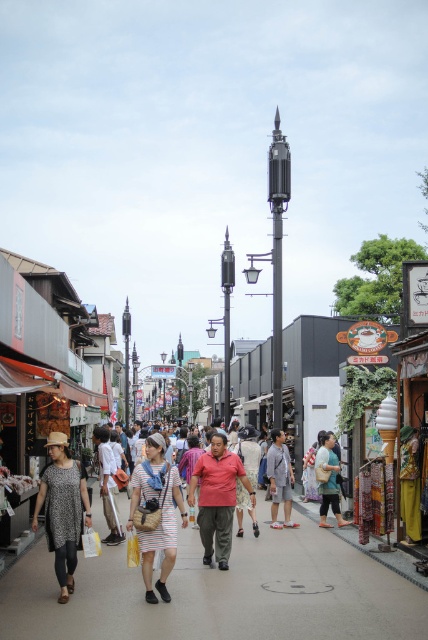
You are a delivery person with a cart that is 2 meters wide. You need to navigate through the gray concrete pavement at center and the green fabric bag at center. Can your cart fit between them?

The distance between the gray concrete pavement at center and the green fabric bag at center is 4.24 meters. Since your cart is only 2 meters wide, it can easily fit within the space provided.

You are a customer in this Japanese street scene, and you see both the striped fabric dress at center and the green fabric bag at center. Which item is closer to you?

The striped fabric dress at center is closer to you because it is in front of the green fabric bag at center.